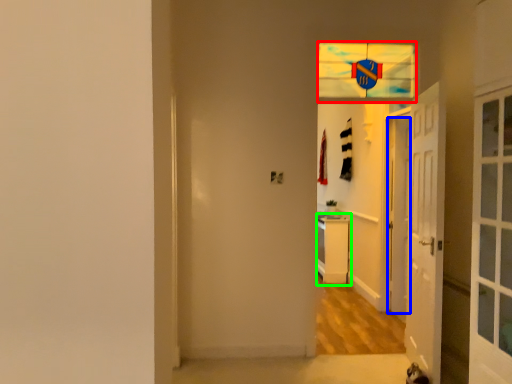
Question: Which object is the farthest from glass window (highlighted by a red box)? Choose among these: door (highlighted by a blue box) or dresser (highlighted by a green box).

Choices:
 (A) door
 (B) dresser

Answer: (B)